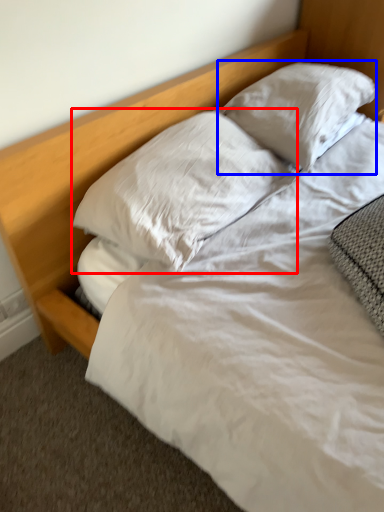
Question: Which of the following is the closest to the observer, pillow (highlighted by a red box) or pillow (highlighted by a blue box)?

Choices:
 (A) pillow
 (B) pillow

Answer: (A)